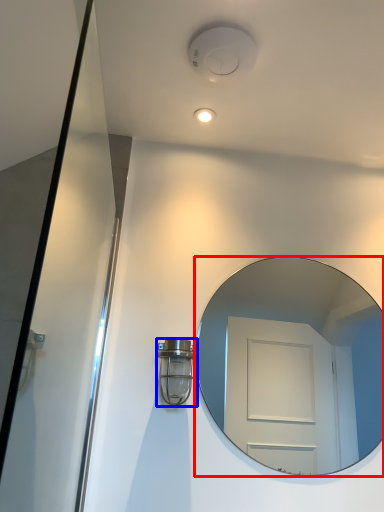
Question: Which of the following is the closest to the observer, mirror (highlighted by a red box) or light fixture (highlighted by a blue box)?

Choices:
 (A) mirror
 (B) light fixture

Answer: (B)